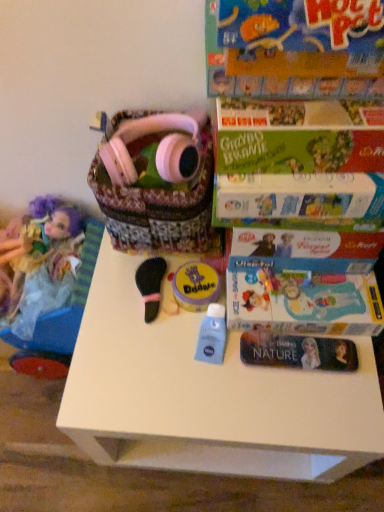
Find the location of a particular element. The height and width of the screenshot is (512, 384). free space to the left of blue matte lotion at center is located at coordinates (131, 354).